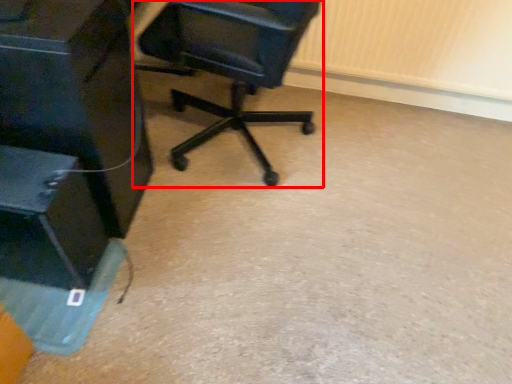
Question: From the image's perspective, where is chair (annotated by the red box) located relative to furniture?

Choices:
 (A) below
 (B) above

Answer: (B)